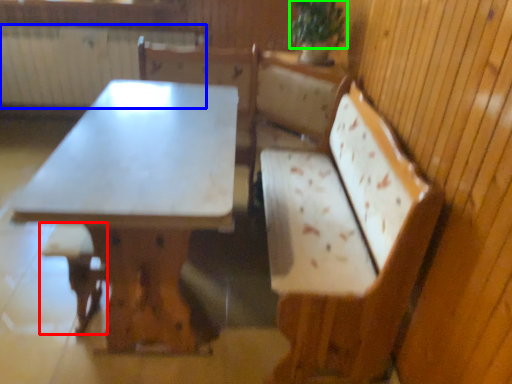
Question: Which is nearer to the step stool (highlighted by a red box)? radiator (highlighted by a blue box) or plant (highlighted by a green box).

Choices:
 (A) radiator
 (B) plant

Answer: (B)